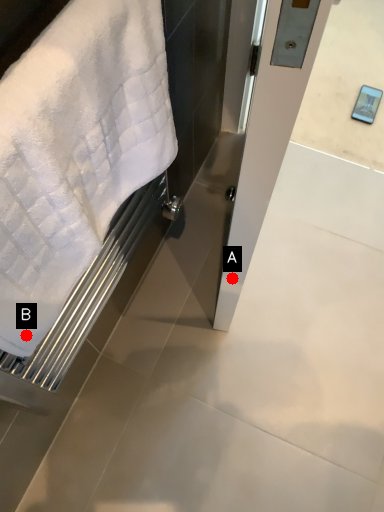
Question: Two points are circled on the image, labeled by A and B beside each circle. Among these points, which one is nearest to the camera?

Choices:
 (A) A is closer
 (B) B is closer

Answer: (B)